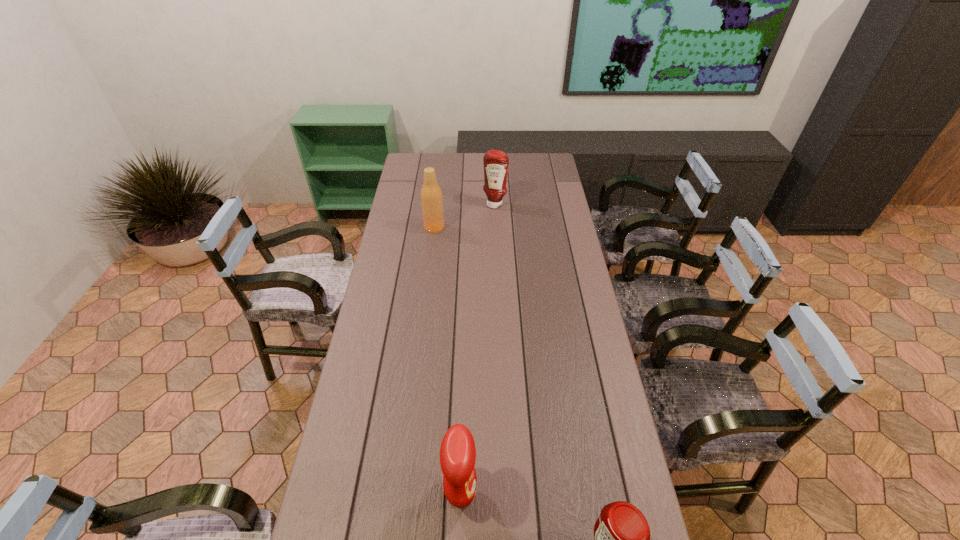
Where is `the leftmost object`? This screenshot has width=960, height=540. the leftmost object is located at coordinates (431, 195).

At what (x,y) coordinates should I click in order to perform the action: click on beer bottle. Please return your answer as a coordinate pair (x, y). Looking at the image, I should click on (431, 195).

This screenshot has height=540, width=960. In order to click on the second condiment from right to left in this screenshot , I will do `click(496, 163)`.

At what (x,y) coordinates should I click in order to perform the action: click on the farthest condiment. Please return your answer as a coordinate pair (x, y). The width and height of the screenshot is (960, 540). Looking at the image, I should click on (496, 163).

I want to click on the third object from right to left, so click(x=457, y=452).

Where is `the third farthest object`? the third farthest object is located at coordinates pos(457,452).

Where is `free location located on the front of the beer bottle`? The width and height of the screenshot is (960, 540). free location located on the front of the beer bottle is located at coordinates (431, 252).

Find the location of a particular element. This screenshot has height=540, width=960. free spot located on the left of the second condiment from right to left is located at coordinates (418, 204).

Identify the location of free region located 0.090m on the label side of the second farthest condiment. (513, 492).

Locate an element on the screen. The height and width of the screenshot is (540, 960). object that is at the left edge is located at coordinates (431, 195).